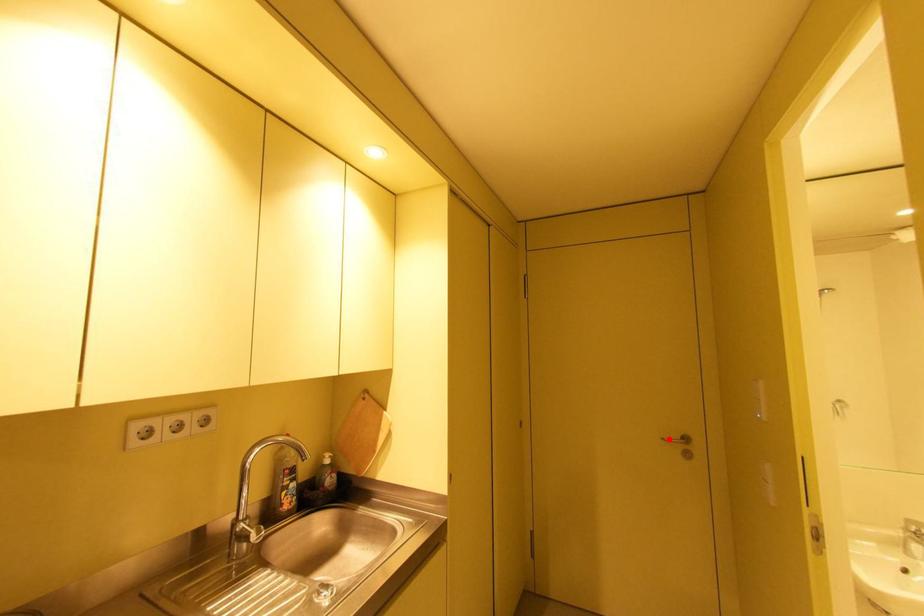
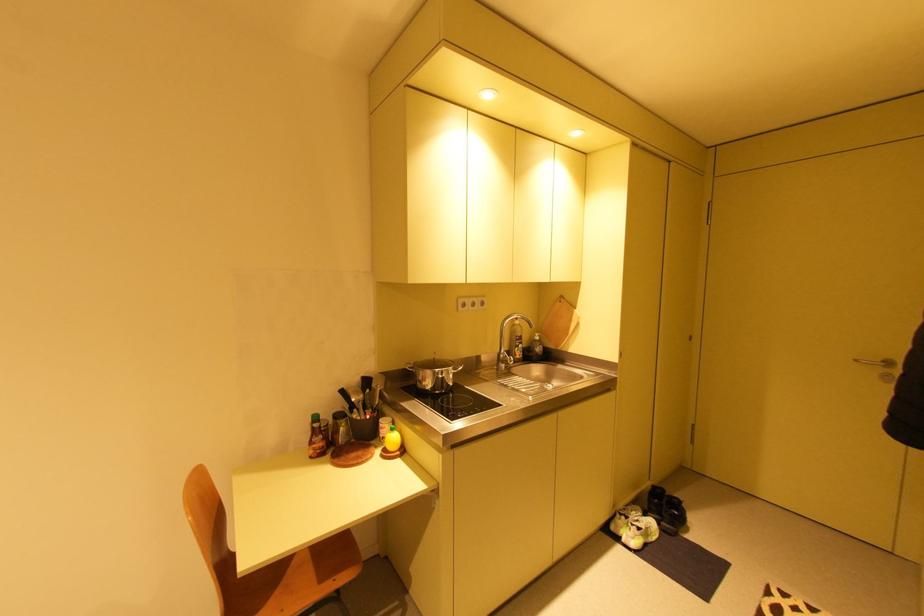
Find the pixel in the second image that matches the highlighted location in the first image.

(861, 361)